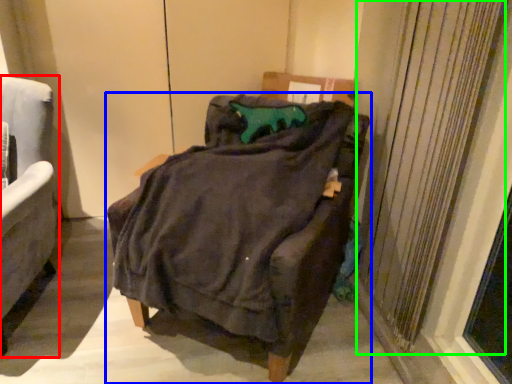
Question: Estimate the real-world distances between objects in this image. Which object is closer to chair (highlighted by a red box), chair (highlighted by a blue box) or curtain (highlighted by a green box)?

Choices:
 (A) chair
 (B) curtain

Answer: (A)